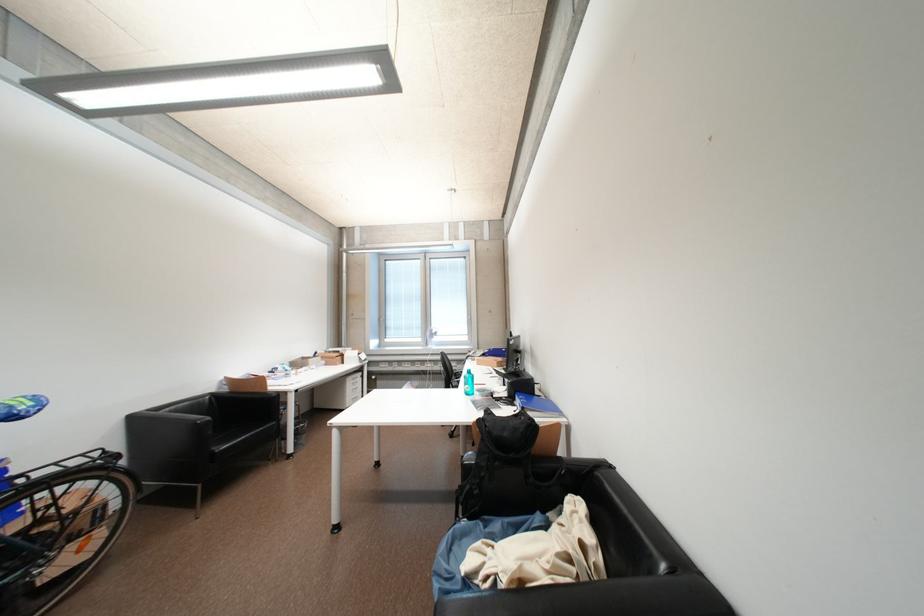
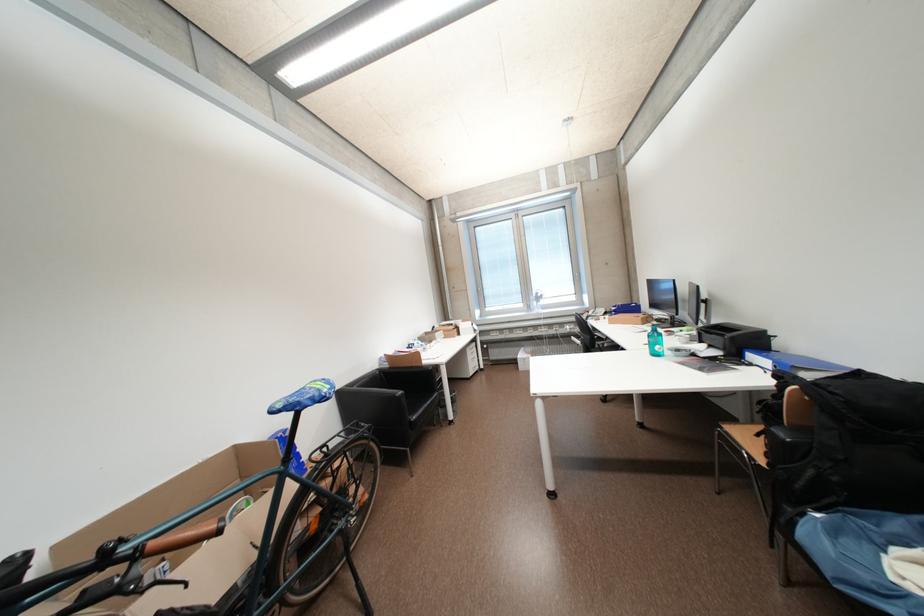
Find the pixel in the second image that matches pixel 473 387 in the first image.

(660, 346)